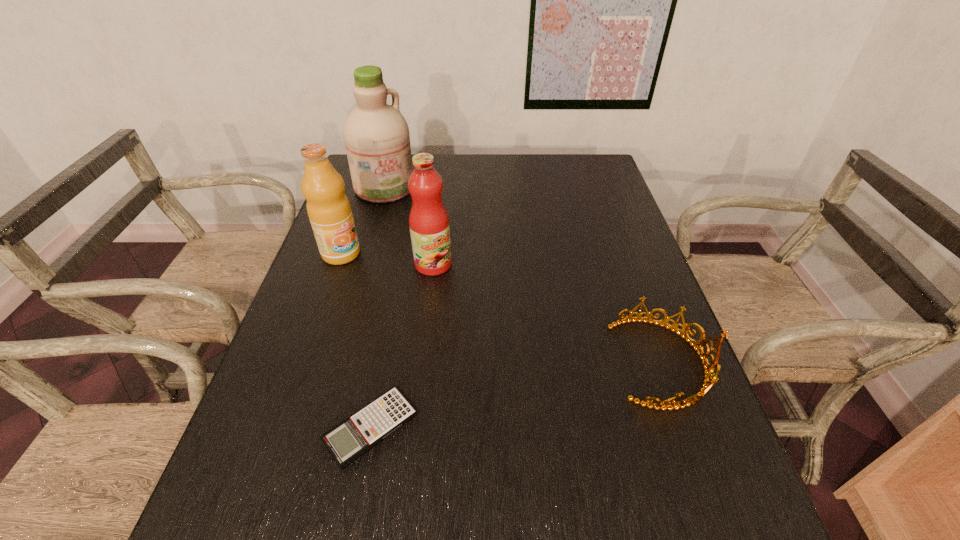
Locate an element on the screen. free space at the far right corner is located at coordinates pyautogui.click(x=592, y=164).

I want to click on vacant area between the left fruit juice and the right fruit juice, so click(x=387, y=259).

Locate an element on the screen. This screenshot has height=540, width=960. free space between the rightmost object and the left fruit juice is located at coordinates (502, 308).

At what (x,y) coordinates should I click in order to perform the action: click on vacant space that is in between the left fruit juice and the rightmost object. Please return your answer as a coordinate pair (x, y). The width and height of the screenshot is (960, 540). Looking at the image, I should click on (502, 308).

The image size is (960, 540). Identify the location of free area in between the second shortest object and the shortest object. (516, 395).

Locate an element on the screen. vacant space in between the calculator and the right fruit juice is located at coordinates (402, 346).

Locate an element on the screen. The image size is (960, 540). vacant point located between the rightmost object and the left fruit juice is located at coordinates (502, 308).

The image size is (960, 540). Identify the location of free spot between the fourth tallest object and the shortest object. (516, 395).

You are a GUI agent. You are given a task and a screenshot of the screen. Output one action in this format:
    pyautogui.click(x=<x>, y=<y>)
    Task: Click on the free point between the shortest object and the tallest object
    This screenshot has height=540, width=960.
    Given the screenshot: What is the action you would take?
    pyautogui.click(x=377, y=308)

Identify the location of vacant area that lies between the calculator and the farthest object. The image size is (960, 540). [x=377, y=308].